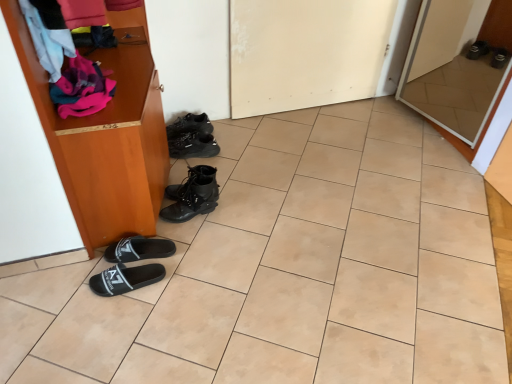
The width and height of the screenshot is (512, 384). Describe the element at coordinates (82, 88) in the screenshot. I see `matte pink fabric at left` at that location.

What is the approximate width of black leather boots at center, which is counted as the third footwear, starting from the top?

It is 24.69 centimeters.

Measure the distance between black leather sneakers at center, positioned as the 5th footwear in bottom-to-top order, and camera.

black leather sneakers at center, positioned as the 5th footwear in bottom-to-top order, is 2.26 meters from camera.

How much space does black leather sneakers at center, which appears as the 2th footwear when viewed from the top, occupy horizontally?

black leather sneakers at center, which appears as the 2th footwear when viewed from the top, is 11.55 inches wide.

In order to face black leather sneakers at center, which appears as the 2th footwear when viewed from the top, should I rotate leftwards or rightwards?

A 7.870 degree turn to the left will do.

You are a GUI agent. You are given a task and a screenshot of the screen. Output one action in this format:
    pyautogui.click(x=<x>, y=<y>)
    Task: Click on the black fabric slipper at lower left, the 2th footwear when ordered from front to back
    This screenshot has width=512, height=384.
    Given the screenshot: What is the action you would take?
    pyautogui.click(x=138, y=249)

From the image's perspective, is matte pink fabric at left below white glossy door at upper right, the 1th door in the right-to-left sequence?

Yes, from the image's perspective, matte pink fabric at left is beneath white glossy door at upper right, the 1th door in the right-to-left sequence.

Measure the distance between matte pink fabric at left and white glossy door at upper right, the 1th door in the right-to-left sequence.

A distance of 6.91 feet exists between matte pink fabric at left and white glossy door at upper right, the 1th door in the right-to-left sequence.

Considering the positions of objects matte pink fabric at left and white glossy door at upper right, the 1th door in the right-to-left sequence, in the image provided, who is more to the left, matte pink fabric at left or white glossy door at upper right, the 1th door in the right-to-left sequence,?

matte pink fabric at left.

Is white glossy door at upper right, the 1th door in the right-to-left sequence, outside of black leather sneakers at center, the 4th footwear positioned from the bottom?

Yes, white glossy door at upper right, the 1th door in the right-to-left sequence, is located beyond the bounds of black leather sneakers at center, the 4th footwear positioned from the bottom.

Does white glossy door at upper right, positioned as the 2th door in left-to-right order, have a greater width compared to black leather sneakers at center, the second footwear in the back-to-front sequence?

No, white glossy door at upper right, positioned as the 2th door in left-to-right order, is not wider than black leather sneakers at center, the second footwear in the back-to-front sequence.

This screenshot has height=384, width=512. Identify the location of footwear that is the 2nd object directly below the white glossy door at upper right, positioned as the 2th door in left-to-right order (from a real-world perspective). (192, 137).

Which is in front, white glossy door at upper right, positioned as the 2th door in left-to-right order, or black leather sneakers at center, the second footwear in the back-to-front sequence?

white glossy door at upper right, positioned as the 2th door in left-to-right order.

Does point (169, 198) come behind point (57, 89)?

Yes.

Is black leather boots at center, which is counted as the third footwear, starting from the top, not inside matte pink fabric at left?

That's correct, black leather boots at center, which is counted as the third footwear, starting from the top, is outside of matte pink fabric at left.

Who is taller, black leather boots at center, arranged as the 3th footwear when viewed from the front, or matte pink fabric at left?

black leather boots at center, arranged as the 3th footwear when viewed from the front, is taller.

From a real-world perspective, who is located lower, black leather boots at center, arranged as the 3th footwear when viewed from the front, or matte pink fabric at left?

In real-world perspective, black leather boots at center, arranged as the 3th footwear when viewed from the front, is lower.

From the picture: In the image, is black leather sneakers at center, positioned as the 5th footwear in bottom-to-top order, on the left side or the right side of black fabric slipper at lower left, the 1th footwear when ordered from bottom to top?

Based on their positions, black leather sneakers at center, positioned as the 5th footwear in bottom-to-top order, is located to the right of black fabric slipper at lower left, the 1th footwear when ordered from bottom to top.

Measure the distance between black leather sneakers at center, which appears as the fifth footwear when viewed from the front, and black fabric slipper at lower left, positioned as the first footwear in front-to-back order.

They are 35.78 inches apart.

From the image's perspective, would you say black leather sneakers at center, which appears as the fifth footwear when viewed from the front, is positioned over black fabric slipper at lower left, the 1th footwear when ordered from bottom to top?

Yes.

Which of these two, black leather sneakers at center, which appears as the fifth footwear when viewed from the front, or black fabric slipper at lower left, the fifth footwear in the back-to-front sequence, is smaller?

Smaller between the two is black fabric slipper at lower left, the fifth footwear in the back-to-front sequence.

Is black fabric slipper at lower left, positioned as the first footwear in front-to-back order, bigger or smaller than white glossy door at upper right, the 1th door in the right-to-left sequence?

In the image, black fabric slipper at lower left, positioned as the first footwear in front-to-back order, appears to be smaller than white glossy door at upper right, the 1th door in the right-to-left sequence.

Is point (94, 279) farther from viewer compared to point (481, 82)?

No, it is in front of (481, 82).

Is black fabric slipper at lower left, positioned as the first footwear in front-to-back order, positioned beyond the bounds of white glossy door at upper right, the 1th door in the right-to-left sequence?

Yes, black fabric slipper at lower left, positioned as the first footwear in front-to-back order, is outside of white glossy door at upper right, the 1th door in the right-to-left sequence.

Is black fabric slipper at lower left, which is the 5th footwear in top-to-bottom order, oriented away from white glossy door at upper right, the 1th door in the right-to-left sequence?

No, black fabric slipper at lower left, which is the 5th footwear in top-to-bottom order, is not facing away from white glossy door at upper right, the 1th door in the right-to-left sequence.

From a real-world perspective, is matte pink fabric at left physically below black fabric slipper at lower left, the fifth footwear in the back-to-front sequence?

No, from a real-world perspective, matte pink fabric at left is not beneath black fabric slipper at lower left, the fifth footwear in the back-to-front sequence.

In the scene shown: Considering the relative sizes of matte pink fabric at left and black fabric slipper at lower left, the fifth footwear in the back-to-front sequence, in the image provided, is matte pink fabric at left smaller than black fabric slipper at lower left, the fifth footwear in the back-to-front sequence,?

Incorrect, matte pink fabric at left is not smaller in size than black fabric slipper at lower left, the fifth footwear in the back-to-front sequence.

Can you tell me how much matte pink fabric at left and black fabric slipper at lower left, which is the 5th footwear in top-to-bottom order, differ in facing direction?

The facing directions of matte pink fabric at left and black fabric slipper at lower left, which is the 5th footwear in top-to-bottom order, are 16.5 degrees apart.

Is black fabric slipper at lower left, the 1th footwear when ordered from bottom to top, surrounded by matte pink fabric at left?

No, black fabric slipper at lower left, the 1th footwear when ordered from bottom to top, is located outside of matte pink fabric at left.

Is white matte door at center, which is the 1th door from left to right, not close to matte pink fabric at left?

Yes, white matte door at center, which is the 1th door from left to right, and matte pink fabric at left are located far from each other.

From the image's perspective, is white matte door at center, the second door positioned from the right, positioned above or below matte pink fabric at left?

white matte door at center, the second door positioned from the right, is above matte pink fabric at left.

Is matte pink fabric at left a part of white matte door at center, which is the 1th door from left to right?

No, matte pink fabric at left is not surrounded by white matte door at center, which is the 1th door from left to right.

I want to click on clothing located above the white glossy door at upper right, positioned as the 2th door in left-to-right order (from a real-world perspective), so click(x=82, y=88).

At what (x,y) coordinates should I click in order to perform the action: click on the 2nd door to the right of the black leather sneakers at center, acting as the 4th footwear starting from the front, counting from the anchor's position. Please return your answer as a coordinate pair (x, y). Looking at the image, I should click on (451, 80).

From the image, which object appears to be nearer to black fabric slipper at lower left, which is the 5th footwear in top-to-bottom order, black fabric slipper at lower left, the 4th footwear from the top, or matte pink fabric at left?

Among the two, black fabric slipper at lower left, the 4th footwear from the top, is located nearer to black fabric slipper at lower left, which is the 5th footwear in top-to-bottom order.

Looking at the image, which one is located further to white glossy door at upper right, the 1th door in the right-to-left sequence, beige tile at center or black fabric slipper at lower left, positioned as the first footwear in front-to-back order?

Among the two, black fabric slipper at lower left, positioned as the first footwear in front-to-back order, is located further to white glossy door at upper right, the 1th door in the right-to-left sequence.

Estimate the real-world distances between objects in this image. Which object is closer to beige tile at center, white glossy door at upper right, the 1th door in the right-to-left sequence, or matte pink fabric at left?

matte pink fabric at left is positioned closer to the anchor beige tile at center.

Looking at the image, which one is located further to black leather boots at center, which is counted as the third footwear, starting from the top, black leather sneakers at center, the 4th footwear positioned from the bottom, or beige tile at center?

beige tile at center.

Based on the photo, when comparing their distances from black leather boots at center, which is counted as the 3th footwear, starting from the bottom, does black fabric slipper at lower left, the 1th footwear when ordered from bottom to top, or matte pink fabric at left seem further?

matte pink fabric at left lies further to black leather boots at center, which is counted as the 3th footwear, starting from the bottom, than the other object.

Based on their spatial positions, is white glossy door at upper right, the 1th door in the right-to-left sequence, or black fabric slipper at lower left, which is the second footwear from bottom to top, further from beige tile at center?

white glossy door at upper right, the 1th door in the right-to-left sequence, is positioned further to the anchor beige tile at center.

Which object lies further to the anchor point black leather boots at center, arranged as the 3th footwear when viewed from the front, white matte door at center, which is the 1th door from left to right, or black leather sneakers at center, the second footwear in the back-to-front sequence?

white matte door at center, which is the 1th door from left to right, is further to black leather boots at center, arranged as the 3th footwear when viewed from the front.

When comparing their distances from white matte door at center, the second door positioned from the right, does beige tile at center or black leather sneakers at center, which ranks as the 1th footwear in top-to-bottom order, seem closer?

black leather sneakers at center, which ranks as the 1th footwear in top-to-bottom order, is closer to white matte door at center, the second door positioned from the right.

At what (x,y) coordinates should I click in order to perform the action: click on clothing that lies between white matte door at center, which is the 1th door from left to right, and black fabric slipper at lower left, positioned as the first footwear in front-to-back order, from top to bottom. Please return your answer as a coordinate pair (x, y). Looking at the image, I should click on (82, 88).

The image size is (512, 384). Find the location of `footwear between black leather boots at center, which is counted as the 3th footwear, starting from the bottom, and black leather sneakers at center, which is the 1th footwear from back to front, in the front-back direction`. footwear between black leather boots at center, which is counted as the 3th footwear, starting from the bottom, and black leather sneakers at center, which is the 1th footwear from back to front, in the front-back direction is located at coordinates pos(192,137).

What are the coordinates of `tile between black fabric slipper at lower left, the fifth footwear in the back-to-front sequence, and white glossy door at upper right, the 1th door in the right-to-left sequence, from left to right` in the screenshot? It's located at (291, 270).

Locate an element on the screen. clothing positioned between beige tile at center and black leather sneakers at center, which appears as the fifth footwear when viewed from the front, from near to far is located at coordinates pyautogui.click(x=82, y=88).